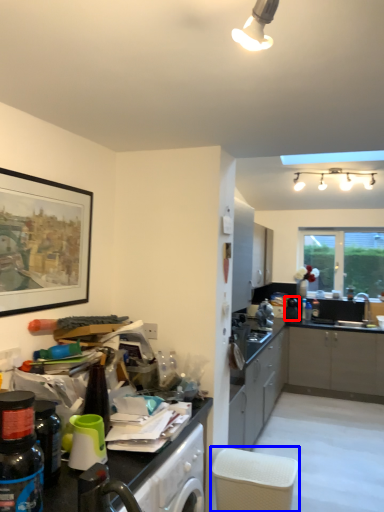
Question: Which object appears closest to the camera in this image, appliance (highlighted by a red box) or chair (highlighted by a blue box)?

Choices:
 (A) appliance
 (B) chair

Answer: (B)